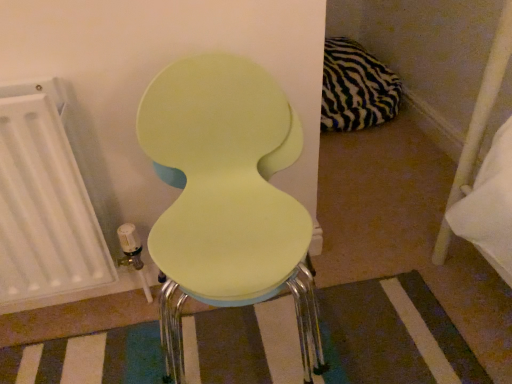
Question: Does point (23, 251) appear closer or farther from the camera than point (187, 61)?

Choices:
 (A) closer
 (B) farther

Answer: (B)

Question: Is white matte radiator at left to the left or to the right of matte green chair at center in the image?

Choices:
 (A) right
 (B) left

Answer: (B)

Question: Which is nearer to the zebra-patterned fabric pillow at upper right?

Choices:
 (A) matte green chair at center
 (B) white matte radiator at left
 (C) matte yellow stool at center

Answer: (C)

Question: Which is farther from the matte yellow stool at center?

Choices:
 (A) zebra-patterned fabric pillow at upper right
 (B) matte green chair at center
 (C) white matte radiator at left

Answer: (A)